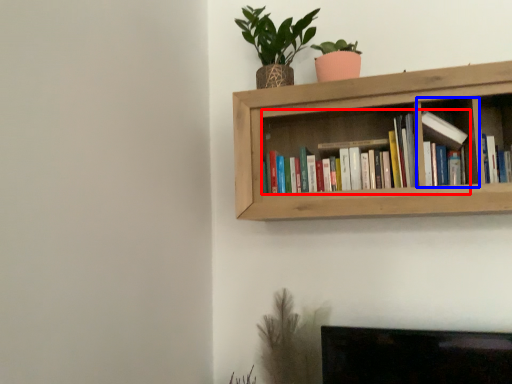
Question: Among these objects, which one is nearest to the camera, book (highlighted by a red box) or cabinet (highlighted by a blue box)?

Choices:
 (A) book
 (B) cabinet

Answer: (B)